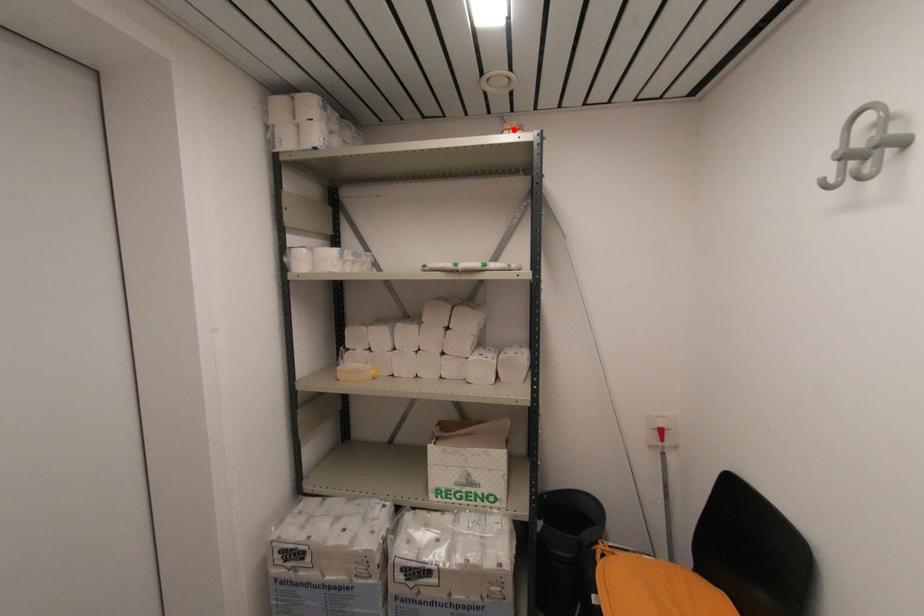
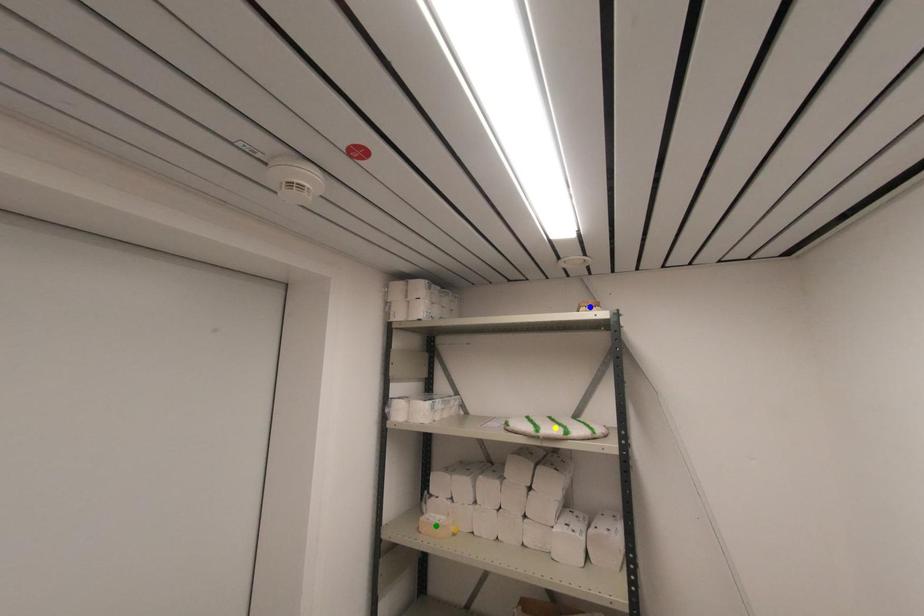
Question: I am providing you with two images of the same scene from different viewpoints. A red point is marked on the first image. You are given multiple points on the second image. Which mark in image 2 goes with the point in image 1?

Choices:
 (A) green point
 (B) yellow point
 (C) blue point

Answer: (C)